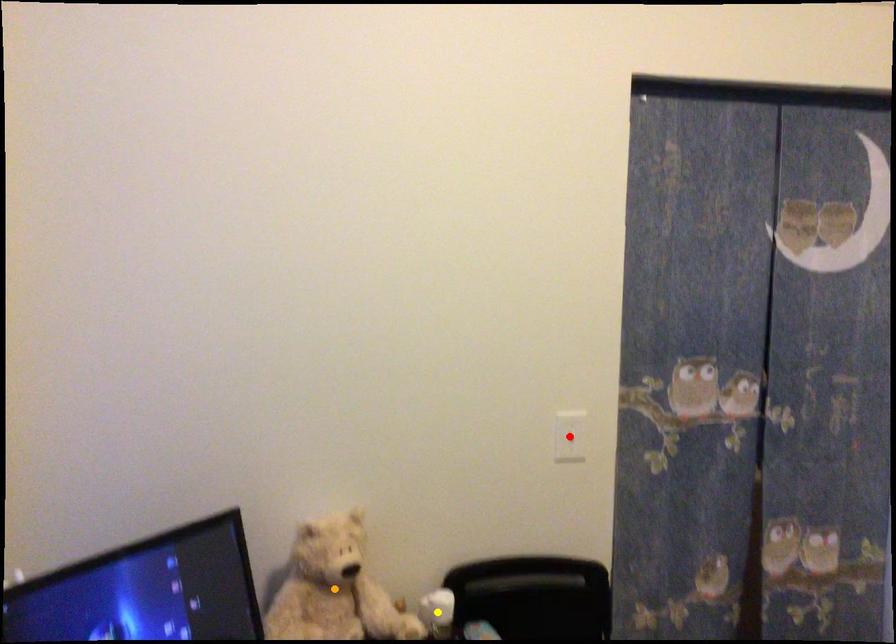
Order these from nearest to farthest:
orange point | yellow point | red point

orange point < yellow point < red point